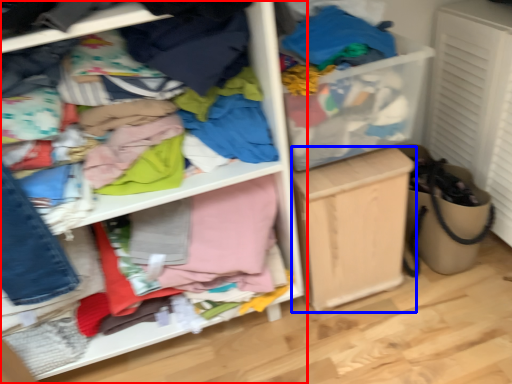
Question: Among these objects, which one is farthest to the camera, shelf (highlighted by a red box) or cabinetry (highlighted by a blue box)?

Choices:
 (A) shelf
 (B) cabinetry

Answer: (B)